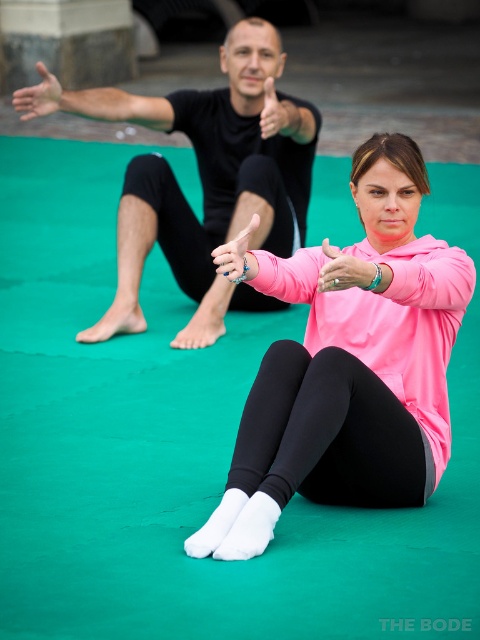
You are a yoga instructor observing the session. You need to ensure that the silver metallic ring at center is within a 10 feet safety distance from the matte black hand at upper center to prevent accidental contact. Is the current distance acceptable?

The silver metallic ring at center is 9.14 feet away from the matte black hand at upper center, which is within the 10 feet safety distance requirement. Therefore, the current distance is acceptable to prevent accidental contact.

You are standing at the point with coordinates point [253,256] and want to walk to the point with coordinates point [348,280]. Is the destination point in front of you or behind you?

The destination point [348,280] is in front of the starting point [253,256].